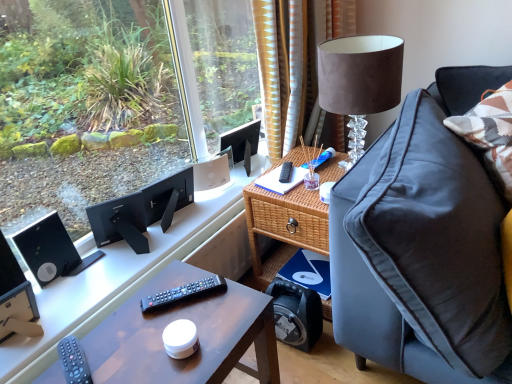
Image resolution: width=512 pixels, height=384 pixels. In order to click on matte black desk at center in this screenshot , I will do `click(198, 333)`.

Find the location of a particular element. The height and width of the screenshot is (384, 512). black plastic remote at center, marked as the 2th remote control in a right-to-left arrangement is located at coordinates click(182, 293).

Locate an element on the screen. The height and width of the screenshot is (384, 512). white matte speaker at upper center is located at coordinates (211, 177).

Describe the element at coordinates (48, 249) in the screenshot. Image resolution: width=512 pixels, height=384 pixels. I see `black plastic speaker at upper left, which ranks as the second loudspeaker in front-to-back order` at that location.

Where is `matte black desk at center`? This screenshot has width=512, height=384. matte black desk at center is located at coordinates (198, 333).

From a real-world perspective, is suede lampshade at upper right physically above black matte computer desk at left?

Yes, from a real-world perspective, suede lampshade at upper right is over black matte computer desk at left

Would you say suede lampshade at upper right is outside black matte computer desk at left?

Absolutely, suede lampshade at upper right is external to black matte computer desk at left.

Which is more distant, (362, 152) or (160, 251)?

Point (362, 152)

Considering the relative positions of suede lampshade at upper right and black matte computer desk at left in the image provided, is suede lampshade at upper right to the left or to the right of black matte computer desk at left?

In the image, suede lampshade at upper right appears on the right side of black matte computer desk at left.

Which is more distant, (60, 251) or (66, 308)?

The point (60, 251) is farther.

Would you consider black plastic speaker at upper left, which ranks as the second loudspeaker in front-to-back order, to be distant from black matte computer desk at left?

black plastic speaker at upper left, which ranks as the second loudspeaker in front-to-back order, is actually quite close to black matte computer desk at left.

Who is more distant, black plastic speaker at upper left, which ranks as the second loudspeaker in front-to-back order, or black matte computer desk at left?

Positioned behind is black plastic speaker at upper left, which ranks as the second loudspeaker in front-to-back order.

Is black plastic speaker at upper left, which appears as the first loudspeaker when viewed from the back, surrounding black matte computer desk at left?

No, black matte computer desk at left is not a part of black plastic speaker at upper left, which appears as the first loudspeaker when viewed from the back.

The width and height of the screenshot is (512, 384). What are the coordinates of `speaker that appears above the black plastic speaker at lower left, which is counted as the first loudspeaker, starting from the front (from the image's perspective)` in the screenshot? It's located at (211, 177).

From a real-world perspective, is white matte speaker at upper center physically located above or below black plastic speaker at lower left, the second loudspeaker in the back-to-front sequence?

In terms of real-world spatial position, white matte speaker at upper center is below black plastic speaker at lower left, the second loudspeaker in the back-to-front sequence.

Is white matte speaker at upper center not within black plastic speaker at lower left, which is counted as the first loudspeaker, starting from the front?

Absolutely, white matte speaker at upper center is external to black plastic speaker at lower left, which is counted as the first loudspeaker, starting from the front.

From the image's perspective, which object appears higher, white matte speaker at upper center or black plastic speaker at lower left, the second loudspeaker in the back-to-front sequence?

white matte speaker at upper center, from the image's perspective.

From the picture: From a real-world perspective, is woven wood side table at center beneath white matte speaker at upper center?

Yes, from a real-world perspective, woven wood side table at center is under white matte speaker at upper center.

Can you confirm if woven wood side table at center is positioned to the right of white matte speaker at upper center?

Indeed, woven wood side table at center is positioned on the right side of white matte speaker at upper center.

Is matte black remote control at lower left, which is counted as the third remote control, starting from the right, positioned with its back to suede lampshade at upper right?

No, matte black remote control at lower left, which is counted as the third remote control, starting from the right, is not facing the opposite direction of suede lampshade at upper right.

Considering the sizes of objects matte black remote control at lower left, the 1th remote control viewed from the left, and suede lampshade at upper right in the image provided, who is taller, matte black remote control at lower left, the 1th remote control viewed from the left, or suede lampshade at upper right?

suede lampshade at upper right is taller.

Can you confirm if matte black remote control at lower left, positioned as the third remote control in top-to-bottom order, is positioned to the right of suede lampshade at upper right?

Incorrect, matte black remote control at lower left, positioned as the third remote control in top-to-bottom order, is not on the right side of suede lampshade at upper right.

Consider the image. Are matte black remote control at lower left, the 1th remote control when ordered from front to back, and suede lampshade at upper right beside each other?

They are not placed beside each other.

Considering the sizes of objects black plastic remote at center, the second remote control ordered from the bottom, and black plastic remote control at upper right, which is counted as the 3th remote control, starting from the bottom, in the image provided, who is bigger, black plastic remote at center, the second remote control ordered from the bottom, or black plastic remote control at upper right, which is counted as the 3th remote control, starting from the bottom,?

black plastic remote at center, the second remote control ordered from the bottom, is bigger.

The height and width of the screenshot is (384, 512). I want to click on remote control that is the 1st one when counting forward from the black plastic remote control at upper right, which is the third remote control in front-to-back order, so click(x=182, y=293).

Can you see black plastic remote at center, marked as the 2th remote control in a right-to-left arrangement, touching black plastic remote control at upper right, the 1th remote control from the back?

No, black plastic remote at center, marked as the 2th remote control in a right-to-left arrangement, is not making contact with black plastic remote control at upper right, the 1th remote control from the back.

From a real-world perspective, is black plastic speaker at upper left, which ranks as the second loudspeaker in front-to-back order, physically above matte black desk at center?

Yes, from a real-world perspective, black plastic speaker at upper left, which ranks as the second loudspeaker in front-to-back order, is over matte black desk at center

Can matte black desk at center be found inside black plastic speaker at upper left, which appears as the first loudspeaker when viewed from the back?

No.

Does point (42, 237) come farther from viewer compared to point (219, 341)?

Yes, it is.

Considering the relative sizes of black plastic speaker at upper left, which appears as the first loudspeaker when viewed from the back, and matte black desk at center in the image provided, is black plastic speaker at upper left, which appears as the first loudspeaker when viewed from the back, shorter than matte black desk at center?

Yes, black plastic speaker at upper left, which appears as the first loudspeaker when viewed from the back, is shorter than matte black desk at center.

The height and width of the screenshot is (384, 512). What are the coordinates of `computer desk below the suede lampshade at upper right (from the image's perspective)` in the screenshot? It's located at (134, 274).

Locate an element on the screen. The image size is (512, 384). computer desk that is under the black plastic speaker at upper left, which appears as the first loudspeaker when viewed from the back (from a real-world perspective) is located at coordinates (134, 274).

Looking at the image, which one is located closer to black plastic remote at center, arranged as the 2th remote control when viewed from the front, black plastic speaker at lower left, which is counted as the first loudspeaker, starting from the front, or black plastic remote control at upper right, the 1th remote control in the right-to-left sequence?

The object closer to black plastic remote at center, arranged as the 2th remote control when viewed from the front, is black plastic speaker at lower left, which is counted as the first loudspeaker, starting from the front.

Based on their spatial positions, is matte black remote control at lower left, the 3th remote control positioned from the back, or woven wood side table at center further from suede lampshade at upper right?

Among the two, matte black remote control at lower left, the 3th remote control positioned from the back, is located further to suede lampshade at upper right.

Which object lies nearer to the anchor point black plastic remote control at upper right, which is counted as the 3th remote control, starting from the bottom, suede lampshade at upper right or black plastic speaker at upper left, which ranks as the second loudspeaker in front-to-back order?

suede lampshade at upper right is positioned closer to the anchor black plastic remote control at upper right, which is counted as the 3th remote control, starting from the bottom.

Which object lies nearer to the anchor point black plastic speaker at upper left, which ranks as the second loudspeaker in front-to-back order, white matte speaker at upper center or matte black remote control at lower left, the 3th remote control positioned from the back?

matte black remote control at lower left, the 3th remote control positioned from the back, is positioned closer to the anchor black plastic speaker at upper left, which ranks as the second loudspeaker in front-to-back order.

When comparing their distances from suede lampshade at upper right, does black plastic speaker at upper left, which appears as the first loudspeaker when viewed from the back, or black plastic remote at center, the second remote control in the top-to-bottom sequence, seem further?

black plastic speaker at upper left, which appears as the first loudspeaker when viewed from the back, is further to suede lampshade at upper right.

Which object lies nearer to the anchor point woven wood side table at center, black plastic remote control at upper right, which appears as the 1th remote control when viewed from the top, or black plastic speaker at lower left, which is counted as the first loudspeaker, starting from the front?

black plastic remote control at upper right, which appears as the 1th remote control when viewed from the top.

Considering their positions, is matte black remote control at lower left, the 3th remote control positioned from the back, positioned closer to black plastic speaker at upper left, which ranks as the second loudspeaker in front-to-back order, than woven wood side table at center?

matte black remote control at lower left, the 3th remote control positioned from the back, is positioned closer to the anchor black plastic speaker at upper left, which ranks as the second loudspeaker in front-to-back order.

Estimate the real-world distances between objects in this image. Which object is further from white matte speaker at upper center, black plastic remote at center, marked as the 2th remote control in a back-to-front arrangement, or suede lampshade at upper right?

Among the two, black plastic remote at center, marked as the 2th remote control in a back-to-front arrangement, is located further to white matte speaker at upper center.

Where is `speaker between black plastic speaker at lower left, the second loudspeaker in the back-to-front sequence, and suede lampshade at upper right, in the horizontal direction`? speaker between black plastic speaker at lower left, the second loudspeaker in the back-to-front sequence, and suede lampshade at upper right, in the horizontal direction is located at coordinates (211, 177).

At what (x,y) coordinates should I click in order to perform the action: click on remote control located between matte black desk at center and black plastic remote at center, marked as the 2th remote control in a back-to-front arrangement, in the depth direction. Please return your answer as a coordinate pair (x, y). The width and height of the screenshot is (512, 384). Looking at the image, I should click on (74, 361).

Find the location of `remote control located between black plastic speaker at lower left, the second loudspeaker in the back-to-front sequence, and black matte computer desk at left in the left-right direction`. remote control located between black plastic speaker at lower left, the second loudspeaker in the back-to-front sequence, and black matte computer desk at left in the left-right direction is located at coordinates 74,361.

Where is `table that lies between suede lampshade at upper right and matte black desk at center from top to bottom`? table that lies between suede lampshade at upper right and matte black desk at center from top to bottom is located at coordinates (285, 221).